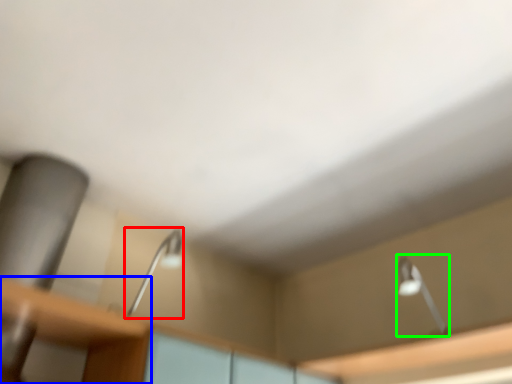
Question: Which is nearer to the lamp (highlighted by a red box)? table (highlighted by a blue box) or lamp (highlighted by a green box).

Choices:
 (A) table
 (B) lamp

Answer: (A)